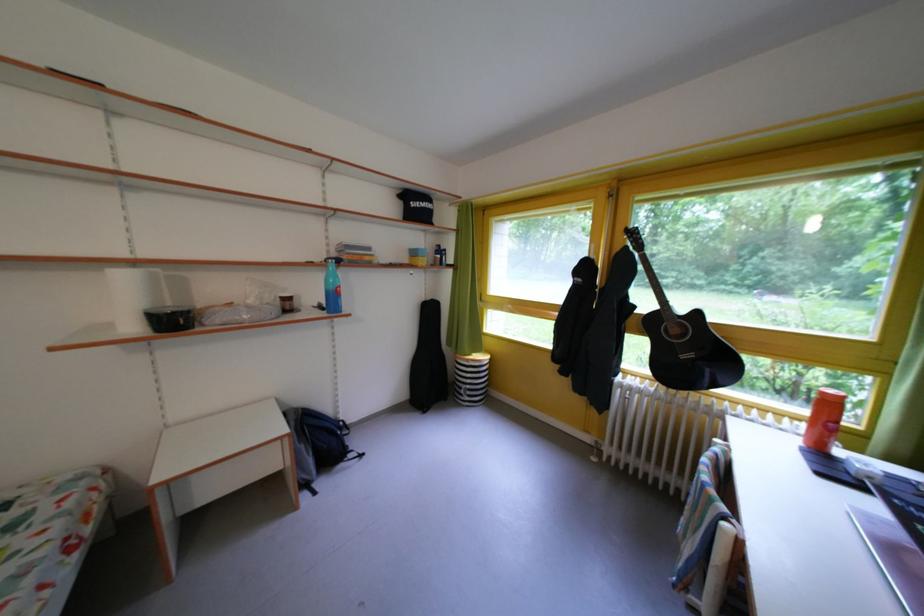
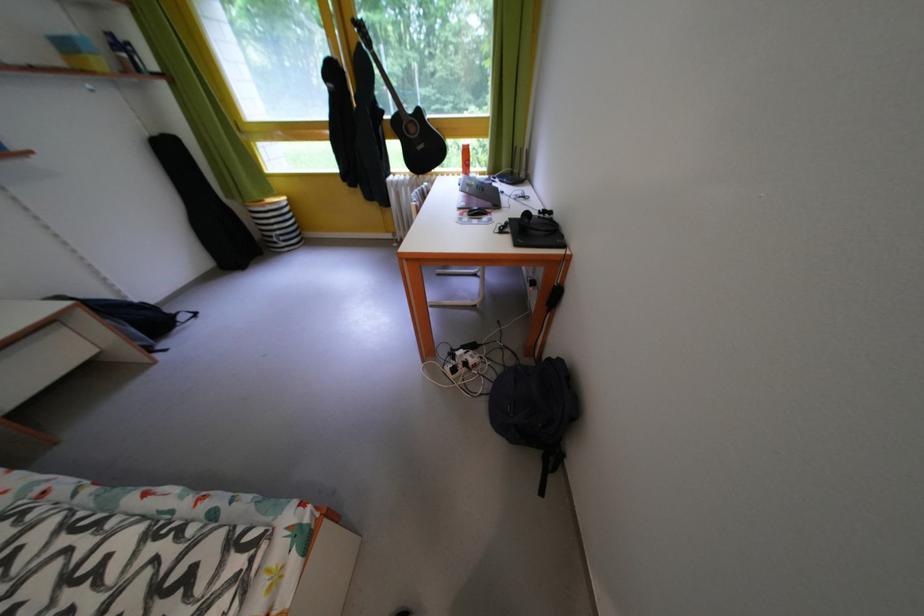
In the second image, find the point that corresponds to point (643, 313) in the first image.

(393, 118)